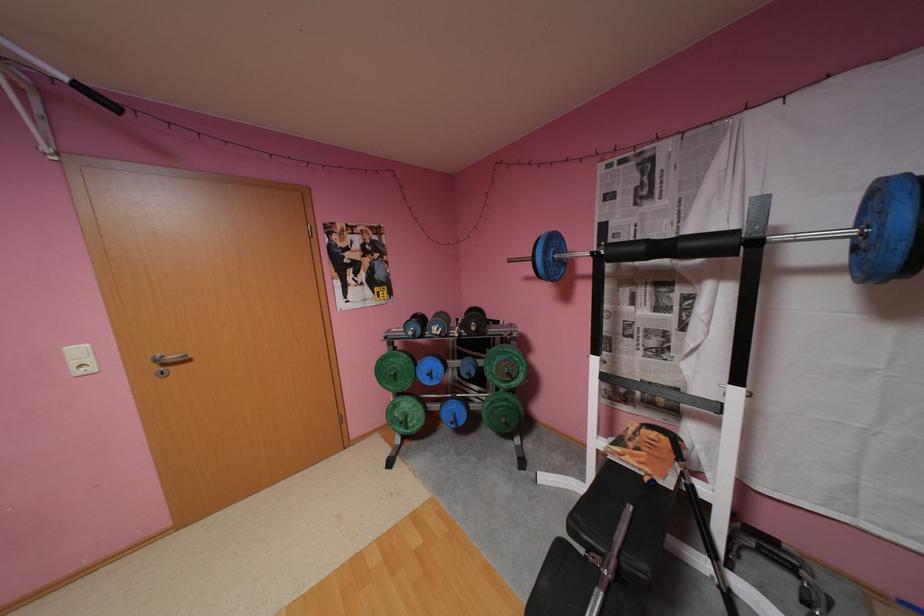
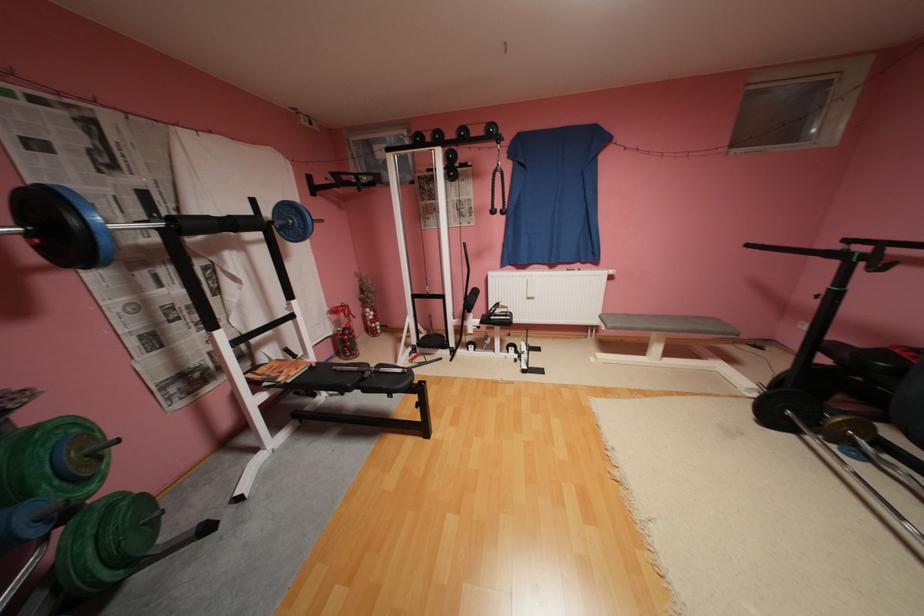
The point at [495,403] is marked in the first image. Where is the corresponding point in the second image?

(100, 551)